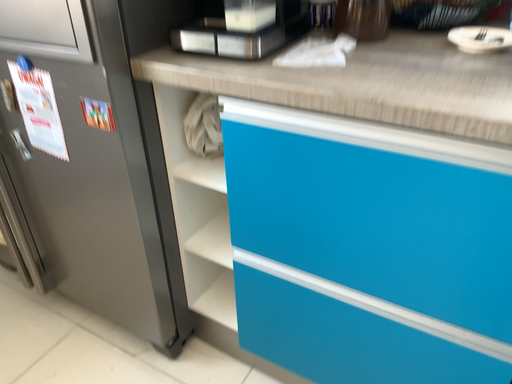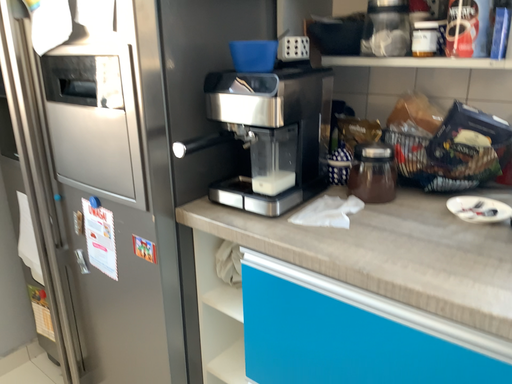
Question: Which way did the camera rotate in the video?

Choices:
 (A) rotated left
 (B) rotated right

Answer: (A)